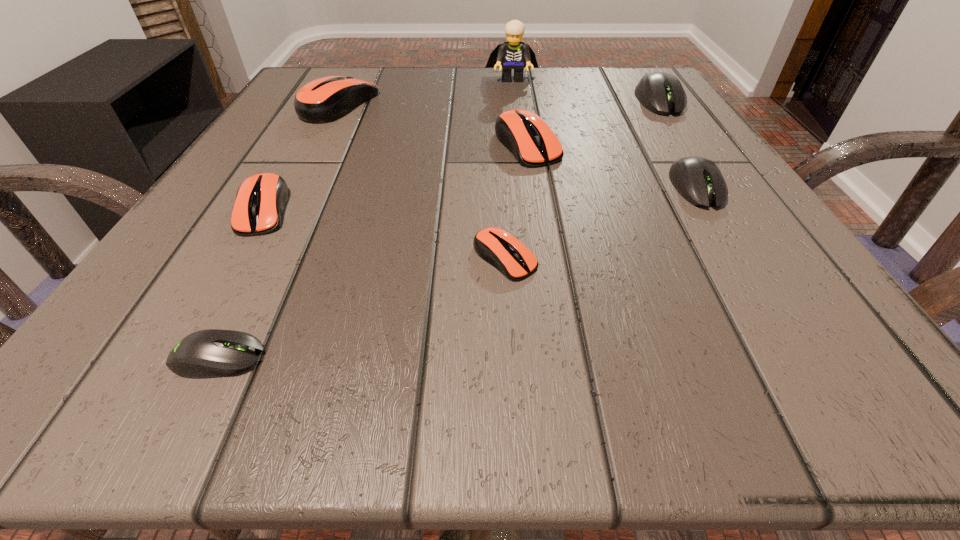
The width and height of the screenshot is (960, 540). In order to click on vacant space positioned 0.360m on the front-facing side of the tallest object in this screenshot , I will do `click(526, 181)`.

You are a GUI agent. You are given a task and a screenshot of the screen. Output one action in this format:
    pyautogui.click(x=<x>, y=<y>)
    Task: Click on the free point located 0.060m on the front of the biggest orange computer mouse
    
    Given the screenshot: What is the action you would take?
    pyautogui.click(x=321, y=141)

This screenshot has width=960, height=540. In order to click on free spot located 0.360m on the wheel side of the biggest gray computer mouse in this screenshot , I will do `click(758, 248)`.

In order to click on vacant space located 0.210m on the right of the second biggest orange computer mouse in this screenshot , I will do `click(685, 145)`.

Where is `free space located on the wheel side of the second smallest gray computer mouse`? free space located on the wheel side of the second smallest gray computer mouse is located at coordinates (805, 366).

This screenshot has width=960, height=540. Find the location of `vacant area located 0.220m on the right of the second smallest orange computer mouse`. vacant area located 0.220m on the right of the second smallest orange computer mouse is located at coordinates (450, 209).

What are the coordinates of `vacant space located 0.140m on the wheel side of the leftmost gray computer mouse` in the screenshot? It's located at (406, 358).

Find the location of a particular element. The height and width of the screenshot is (540, 960). blank space located 0.310m on the left of the smallest orange computer mouse is located at coordinates (219, 258).

Where is `Lego positioned at the far edge`? The image size is (960, 540). Lego positioned at the far edge is located at coordinates tap(514, 54).

You are a GUI agent. You are given a task and a screenshot of the screen. Output one action in this format:
    pyautogui.click(x=<x>, y=<y>)
    Task: Click on the object situated at the near edge
    
    Given the screenshot: What is the action you would take?
    pyautogui.click(x=212, y=353)